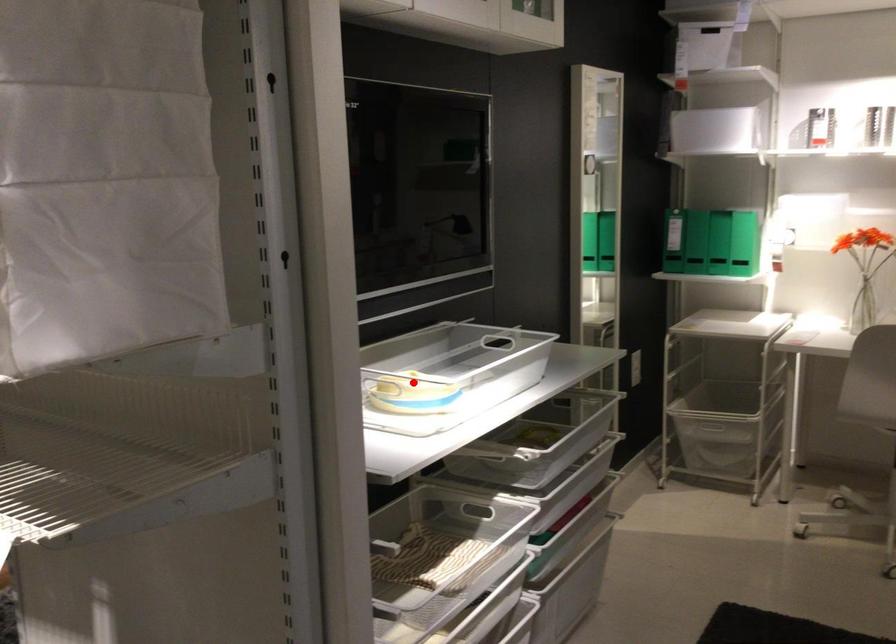
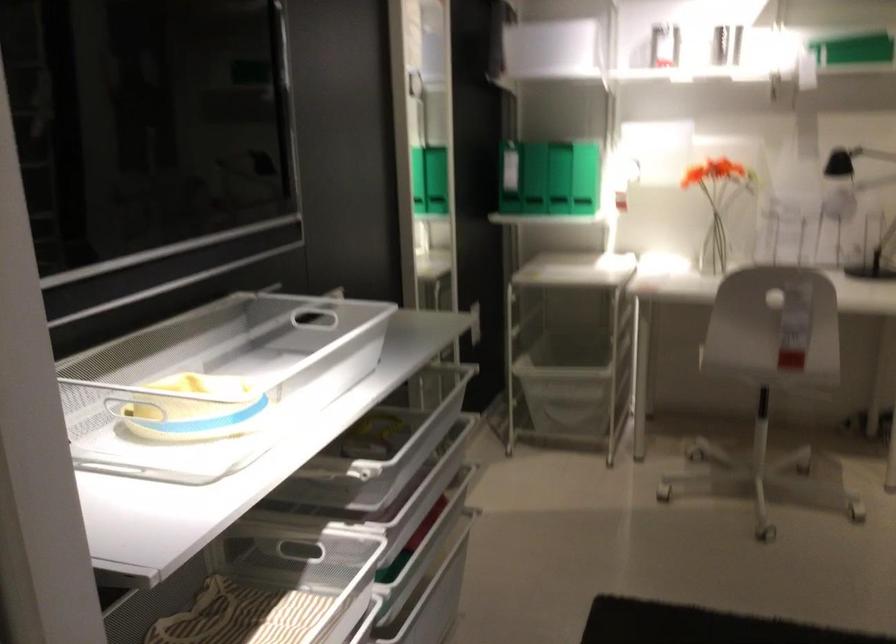
Locate, in the second image, the point that corresponds to the highlighted location in the first image.

(216, 383)